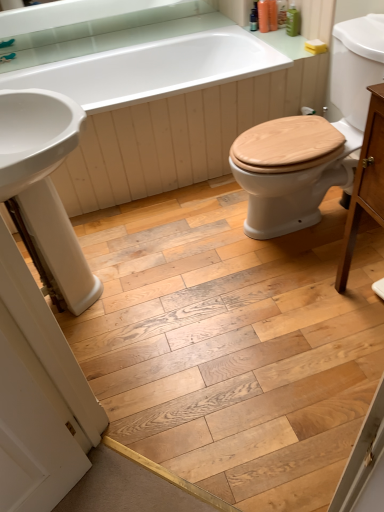
This screenshot has width=384, height=512. In order to click on free space in front of wooden at right in this screenshot , I will do `click(302, 301)`.